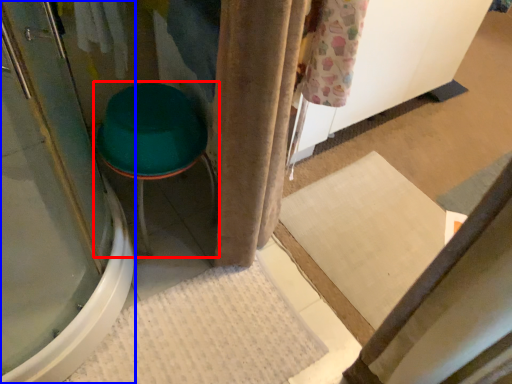
Question: Which point is further to the camera, furniture (highlighted by a red box) or screen door (highlighted by a blue box)?

Choices:
 (A) furniture
 (B) screen door

Answer: (A)